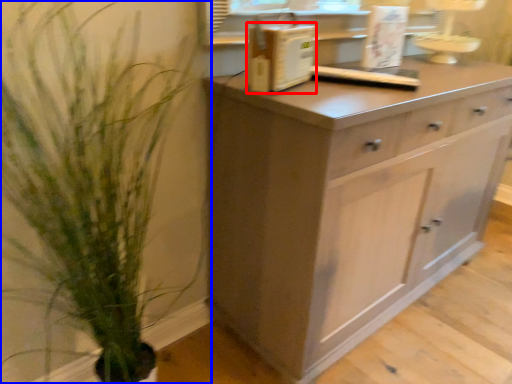
Question: Which point is closer to the camera, appliance (highlighted by a red box) or houseplant (highlighted by a blue box)?

Choices:
 (A) appliance
 (B) houseplant

Answer: (B)